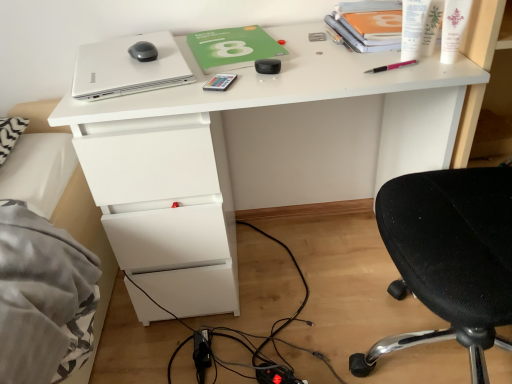
Find the location of a particular element. The height and width of the screenshot is (384, 512). free space between green matte notebook at center and white plastic pen at upper right, the 3th stationery when ordered from left to right is located at coordinates (322, 56).